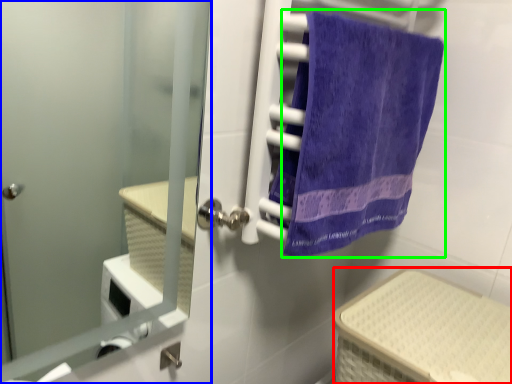
Question: Which is nearer to the basket (highlighted by a red box)? door (highlighted by a blue box) or towel (highlighted by a green box).

Choices:
 (A) door
 (B) towel

Answer: (B)